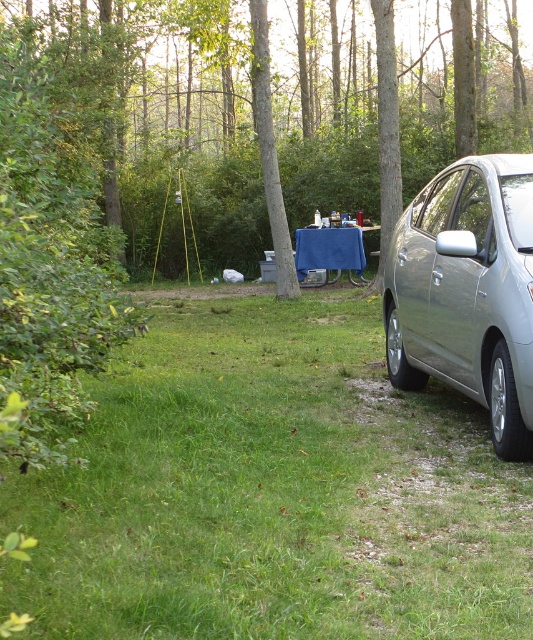
Question: Which point is farther from the camera taking this photo?

Choices:
 (A) (337, 236)
 (B) (268, 237)
 (C) (457, 248)

Answer: (B)

Question: Can you confirm if silver metallic car at right is positioned to the left of blue fabric picnic table at center?

Choices:
 (A) no
 (B) yes

Answer: (A)

Question: Which point is farther from the camera taking this photo?

Choices:
 (A) (322, 248)
 (B) (247, 141)
 (C) (399, 221)
 (D) (410, 621)

Answer: (B)

Question: From the image, what is the correct spatial relationship of green grass at lower left in relation to green leafy tree at center?

Choices:
 (A) left
 (B) right

Answer: (B)

Question: Does green grass at lower left appear over green leafy tree at center?

Choices:
 (A) no
 (B) yes

Answer: (A)

Question: Which object is the farthest from the green leafy tree at center?

Choices:
 (A) silver metallic car at right
 (B) blue fabric picnic table at center
 (C) green grass at lower left

Answer: (C)